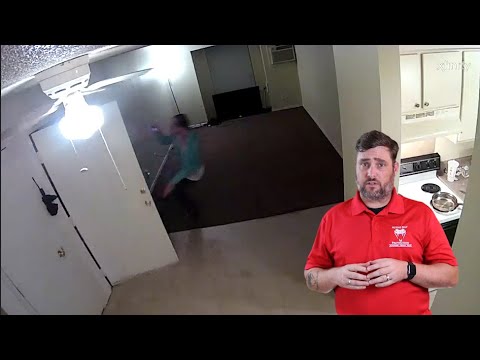
Locate an element on the screen. The image size is (480, 360). pan on oven is located at coordinates (440, 202).